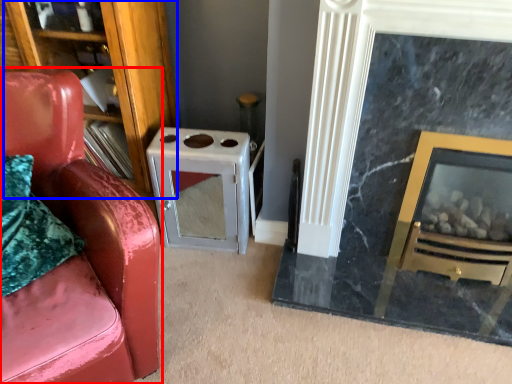
Question: Which object is further to the camera taking this photo, chair (highlighted by a red box) or bookshelf (highlighted by a blue box)?

Choices:
 (A) chair
 (B) bookshelf

Answer: (B)